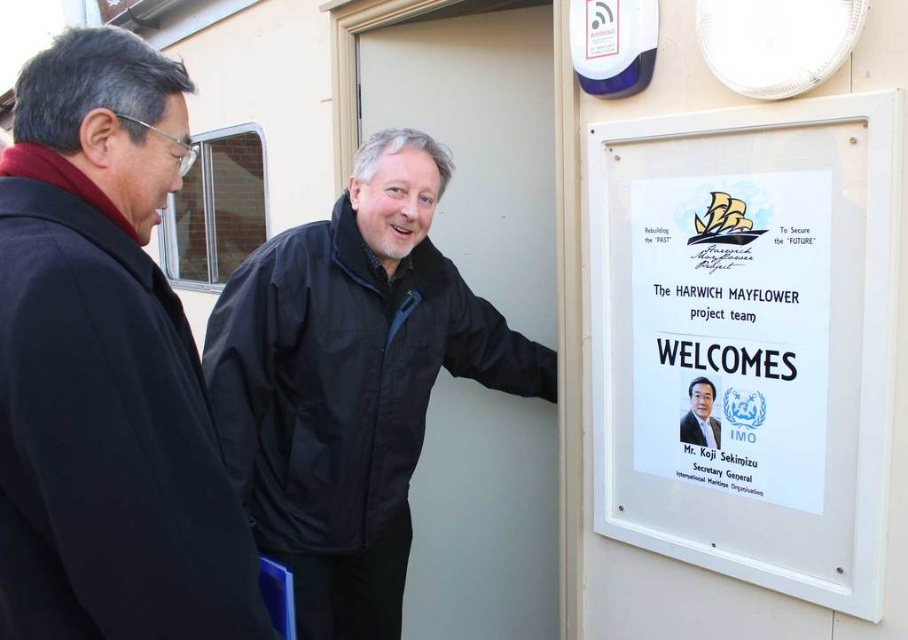
Question: Can you confirm if black matte coat at left is positioned to the right of white paper at center?

Choices:
 (A) no
 (B) yes

Answer: (A)

Question: Which of the following is the farthest from the observer?

Choices:
 (A) white paper at center
 (B) black matte coat at left
 (C) black matte jacket at center
 (D) white plastic sign at center

Answer: (C)

Question: Among these points, which one is nearest to the camera?

Choices:
 (A) (205, 486)
 (B) (385, 444)
 (C) (823, 240)
 (D) (815, 243)

Answer: (A)

Question: Which point appears closest to the camera in this image?

Choices:
 (A) (820, 355)
 (B) (10, 360)
 (C) (753, 381)
 (D) (395, 573)

Answer: (B)

Question: Observing the image, what is the correct spatial positioning of black matte jacket at center in reference to white paper at center?

Choices:
 (A) right
 (B) left

Answer: (B)

Question: Observing the image, what is the correct spatial positioning of black matte coat at left in reference to black matte jacket at center?

Choices:
 (A) right
 (B) left

Answer: (B)